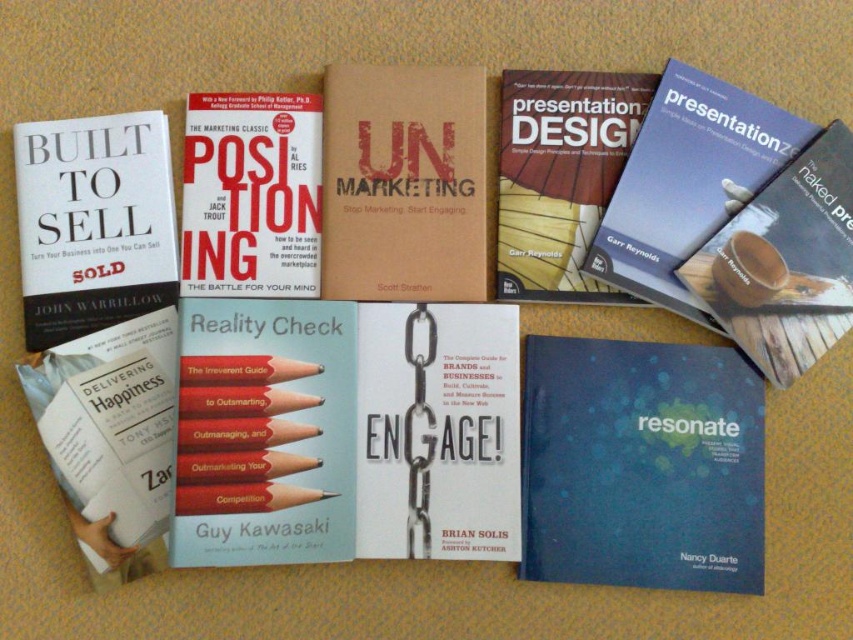
You are organizing a desk and have both the blue matte book at lower right and the blue pencil at center. If you want to stack them vertically, which one should go on the bottom to ensure stability?

The blue pencil at center should go on the bottom since it is taller than the blue matte book at lower right, providing a stable base for stacking.

You have a small blue pencil at center and a larger blue matte book at lower right on your desk. You need to place both items into a drawer that can only fit items narrower than the pencil. Which item can you place in the drawer?

The blue pencil at center can be placed in the drawer since it is narrower than the blue matte book at lower right, which is too wide to fit.

You are a photographer who needs to capture a closeup of the blue matte book at lower right. The camera you are using has a minimum focusing distance of 35 inches. Can you take the closeup without moving the camera or the book?

The blue matte book at lower right and camera are 34.70 inches apart, which is less than the camera minimum focusing distance of 35 inches. Therefore, you cannot take the closeup without moving the camera or the book.